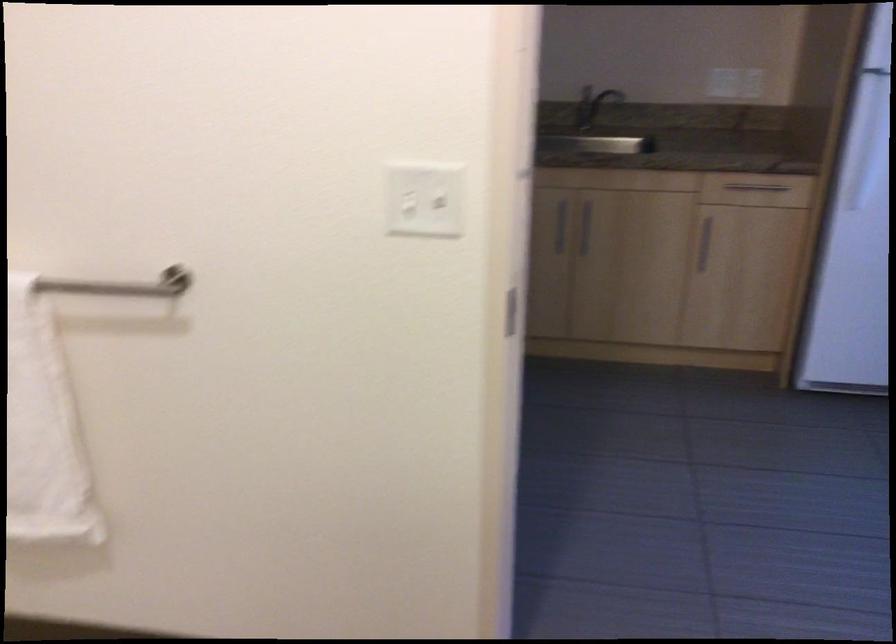
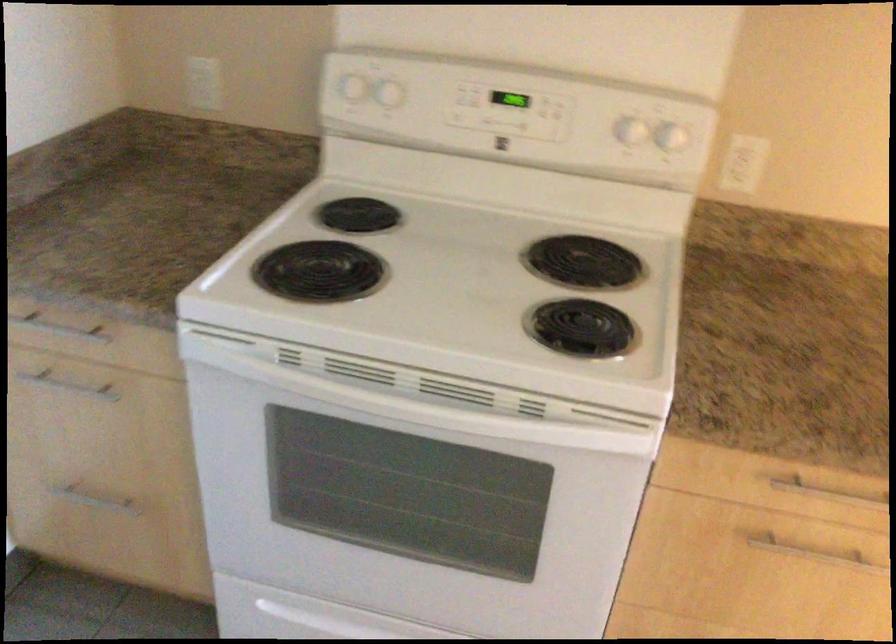
Which direction would the cameraman need to move to produce the second image?

The cameraman walked toward left, forward.